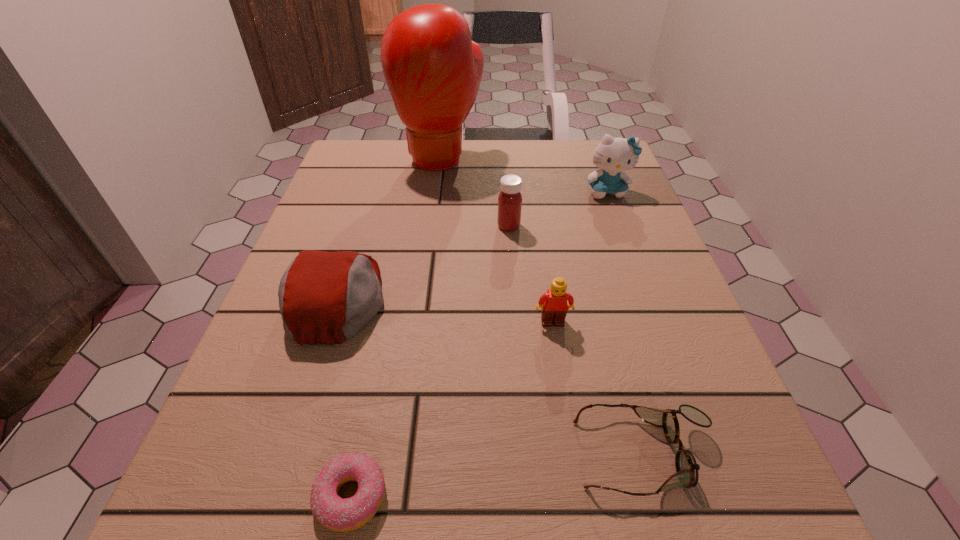
Where is `vacant space that satisfies the following two spatial constraints: 1. on the striking surface of the tallest object; 2. on the front-facing side of the cap`? vacant space that satisfies the following two spatial constraints: 1. on the striking surface of the tallest object; 2. on the front-facing side of the cap is located at coordinates (422, 299).